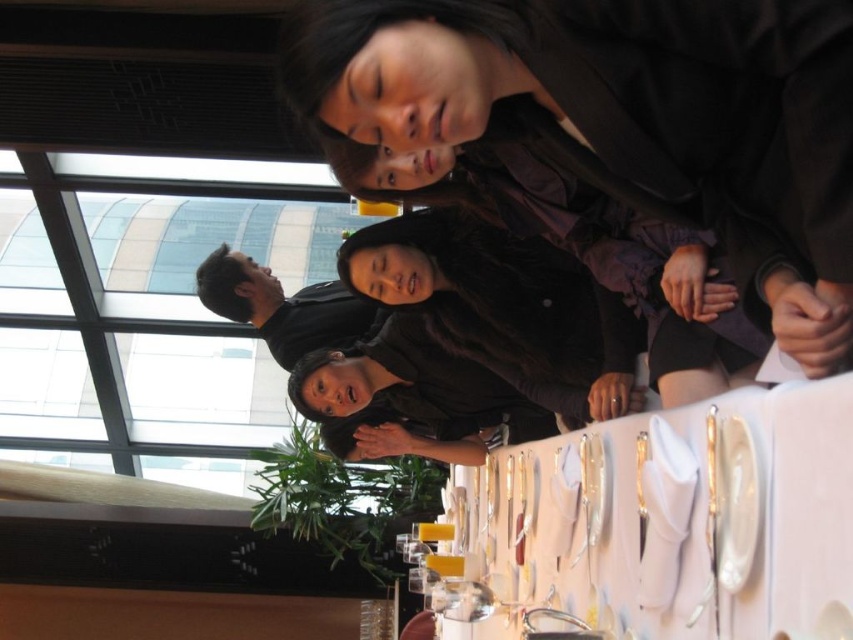
Question: Observing the image, what is the correct spatial positioning of dark brown leather jacket at upper center in reference to white cloth at center?

Choices:
 (A) right
 (B) left

Answer: (B)

Question: Which of the following is the farthest from the observer?

Choices:
 (A) (769, 420)
 (B) (686, 28)

Answer: (A)

Question: Which point is farther to the camera?

Choices:
 (A) (817, 451)
 (B) (561, 161)

Answer: (B)

Question: Does dark brown leather jacket at upper center appear over white cloth at center?

Choices:
 (A) yes
 (B) no

Answer: (A)

Question: Can you confirm if dark brown leather jacket at upper center is bigger than white cloth at center?

Choices:
 (A) yes
 (B) no

Answer: (B)